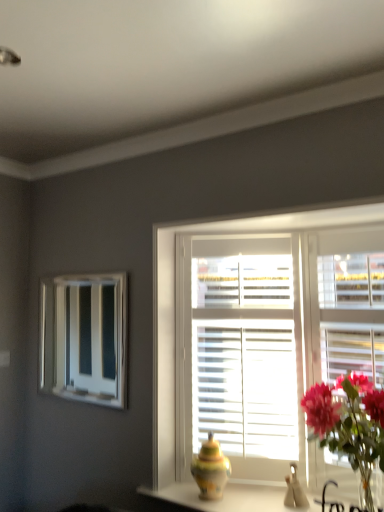
Question: Does multicolored ceramic vase at center appear on the left side of white glossy mirror at upper left?

Choices:
 (A) yes
 (B) no

Answer: (B)

Question: Is multicolored ceramic vase at center wider than white glossy mirror at upper left?

Choices:
 (A) no
 (B) yes

Answer: (B)

Question: Is multicolored ceramic vase at center oriented away from white glossy mirror at upper left?

Choices:
 (A) yes
 (B) no

Answer: (B)

Question: Is multicolored ceramic vase at center next to white glossy mirror at upper left?

Choices:
 (A) no
 (B) yes

Answer: (A)

Question: Is multicolored ceramic vase at center in front of white glossy mirror at upper left?

Choices:
 (A) no
 (B) yes

Answer: (B)

Question: Is multicolored ceramic vase at center bigger or smaller than white wooden window at center?

Choices:
 (A) small
 (B) big

Answer: (A)

Question: From the image's perspective, relative to white wooden window at center, is multicolored ceramic vase at center above or below?

Choices:
 (A) below
 (B) above

Answer: (A)

Question: Do you think multicolored ceramic vase at center is within white wooden window at center, or outside of it?

Choices:
 (A) inside
 (B) outside

Answer: (B)

Question: Considering the relative positions of multicolored ceramic vase at center and white wooden window at center in the image provided, is multicolored ceramic vase at center to the left or to the right of white wooden window at center?

Choices:
 (A) left
 (B) right

Answer: (A)

Question: Choose the correct answer: Is white wooden window at center inside multicolored ceramic vase at center or outside it?

Choices:
 (A) outside
 (B) inside

Answer: (A)

Question: From a real-world perspective, is white wooden window at center above or below multicolored ceramic vase at center?

Choices:
 (A) below
 (B) above

Answer: (B)

Question: Is white wooden window at center wider or thinner than multicolored ceramic vase at center?

Choices:
 (A) wide
 (B) thin

Answer: (A)

Question: Considering the relative positions of white wooden window at center and multicolored ceramic vase at center in the image provided, is white wooden window at center to the left or to the right of multicolored ceramic vase at center?

Choices:
 (A) left
 (B) right

Answer: (B)

Question: In terms of size, does multicolored ceramic vase at center appear bigger or smaller than matte ceramic vase at center?

Choices:
 (A) small
 (B) big

Answer: (A)

Question: Is multicolored ceramic vase at center inside the boundaries of matte ceramic vase at center, or outside?

Choices:
 (A) inside
 (B) outside

Answer: (B)